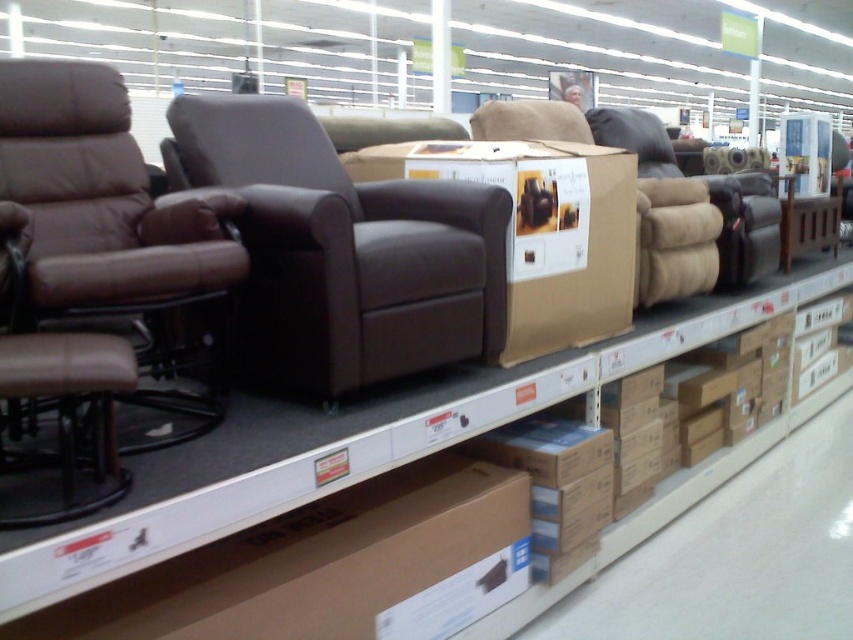
Question: In this image, where is brown leather armchair at center located relative to brown leather swivel chair at left?

Choices:
 (A) below
 (B) above

Answer: (B)

Question: Which point is farther to the camera?

Choices:
 (A) (126, 244)
 (B) (329, 224)

Answer: (A)

Question: Which object is closer to the camera taking this photo?

Choices:
 (A) brown leather swivel chair at left
 (B) brown leather armchair at center

Answer: (A)

Question: Can you confirm if brown leather armchair at center is positioned below brown leather swivel chair at left?

Choices:
 (A) no
 (B) yes

Answer: (A)

Question: Is brown leather armchair at center wider than brown leather swivel chair at left?

Choices:
 (A) no
 (B) yes

Answer: (B)